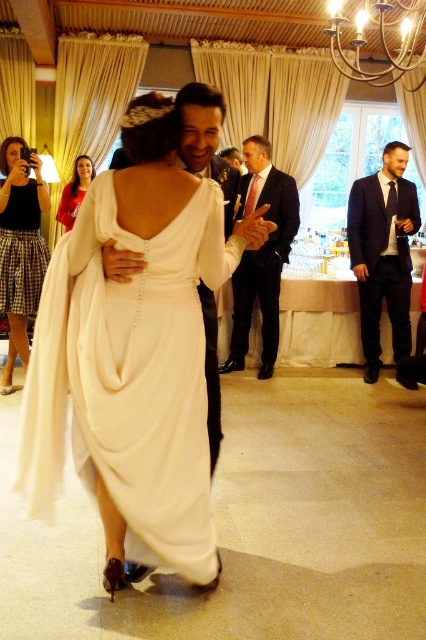
Question: Is dark suit at center further to the viewer compared to plaid skirt at lower left?

Choices:
 (A) yes
 (B) no

Answer: (A)

Question: Where is dark blue suit at right located in relation to dark suit at center in the image?

Choices:
 (A) left
 (B) right

Answer: (B)

Question: Which object is the closest to the white satin dress at center?

Choices:
 (A) plaid skirt at lower left
 (B) dark suit at center
 (C) dark blue suit at right

Answer: (A)

Question: Based on their relative distances, which object is farther from the matte red dress at upper left?

Choices:
 (A) white satin dress at center
 (B) dark blue suit at right
 (C) shiny black suit at center

Answer: (A)

Question: Can you confirm if dark blue suit at right is thinner than dark suit at center?

Choices:
 (A) no
 (B) yes

Answer: (B)

Question: Which point appears closest to the camera in this image?

Choices:
 (A) (6, 310)
 (B) (207, 291)
 (C) (144, 531)
 (D) (247, 332)

Answer: (C)